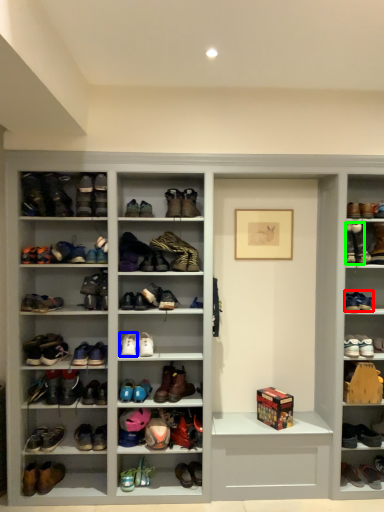
Question: Estimate the real-world distances between objects in this image. Which object is farther from footwear (highlighted by a red box), footwear (highlighted by a blue box) or footwear (highlighted by a green box)?

Choices:
 (A) footwear
 (B) footwear

Answer: (A)